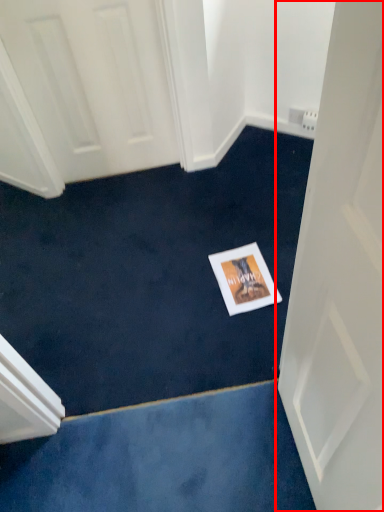
Question: From the image's perspective, where is door (annotated by the red box) located in relation to postcard in the image?

Choices:
 (A) below
 (B) above

Answer: (A)